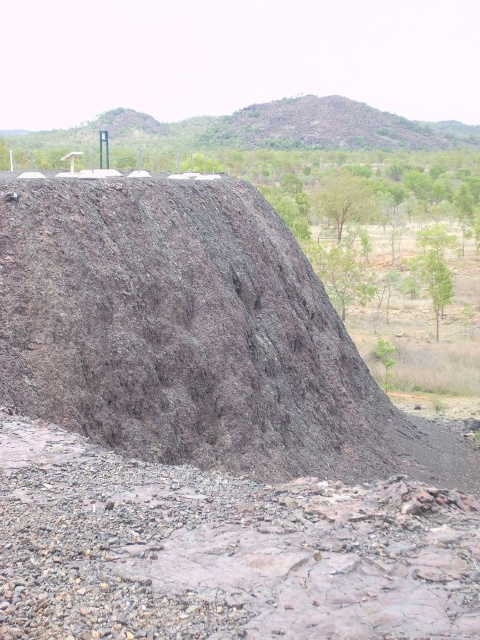
You are a drone operator trying to capture a photo of the two points on the mound. The first point is at coordinates point (106, 532) and the second is at point (346, 113). Which point will appear larger in the photo?

Point (106, 532) is closer to the camera than point (346, 113), so it will appear larger in the photo.

You are a construction worker needing to choose between the brown gravel at center and the brown rough rock at upper center for a drainage project. Which material would be more suitable for allowing water to drain through easily?

The brown gravel at center is smaller than the brown rough rock at upper center, so it has smaller particles which allow water to drain through more easily.